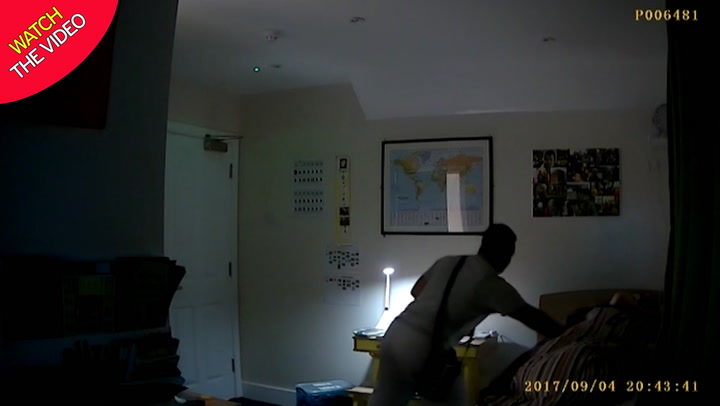
The image size is (720, 406). I want to click on panels on door, so click(186, 337), click(216, 332), click(184, 230), click(214, 233).